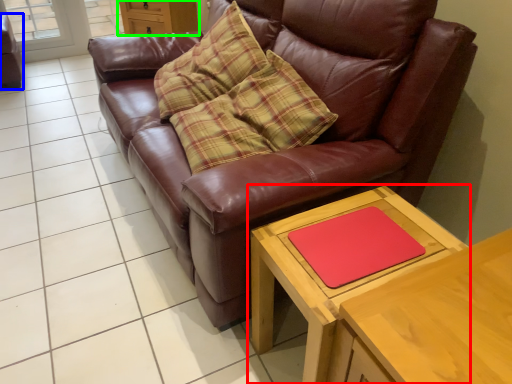
Question: Estimate the real-world distances between objects in this image. Which object is closer to table (highlighted by a red box), swivel chair (highlighted by a blue box) or dresser (highlighted by a green box)?

Choices:
 (A) swivel chair
 (B) dresser

Answer: (B)